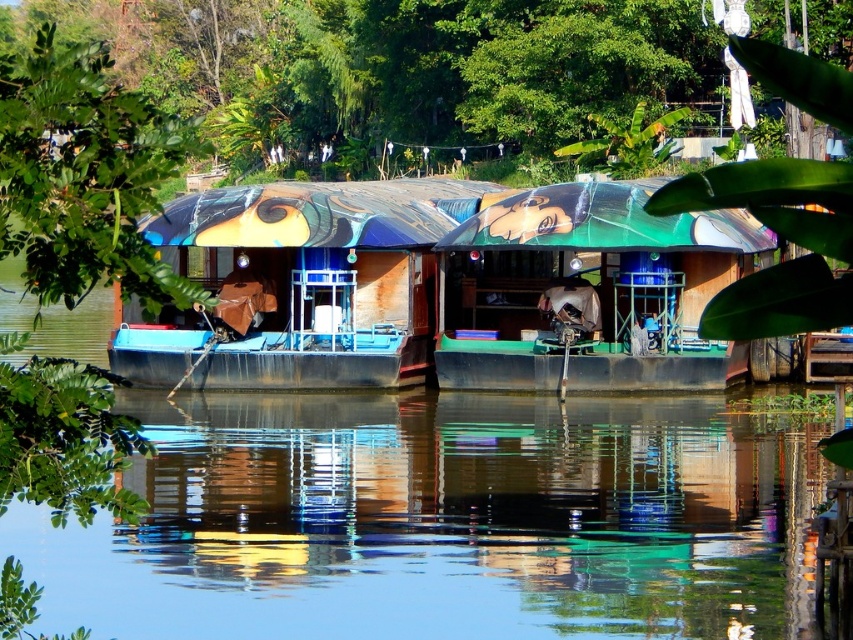
You are standing on the dock and want to board the green matte boat at center. Which direction should you walk from the matte blue boat at center to reach it?

You should walk to the right from the matte blue boat at center to reach the green matte boat at center since the matte blue boat at center is to the left of the green matte boat at center.

You are a photographer trying to capture the reflection of the matte blue boat at center in the transparent water at center. Based on the scene description, can you confirm if the reflection will be visible?

The transparent water at center is in front of the matte blue boat at center, so the reflection of the matte blue boat at center would not be visible in the transparent water at center since the boat is behind the water from the photographer perspective.

You are a photographer standing on the dock and want to take a photo of the two points mentioned. Which point, point (564, 410) or point (340, 356), will appear larger in your photo?

Point (564, 410) is closer to the camera than point (340, 356), so it will appear larger in the photo.